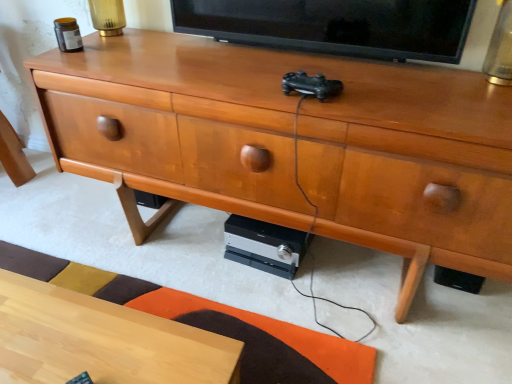
You are a GUI agent. You are given a task and a screenshot of the screen. Output one action in this format:
    pyautogui.click(x=<x>, y=<y>)
    Task: Click on the free spot to the left of silver/black plastic stereo at lower center
    The image size is (512, 384).
    Given the screenshot: What is the action you would take?
    pyautogui.click(x=196, y=249)